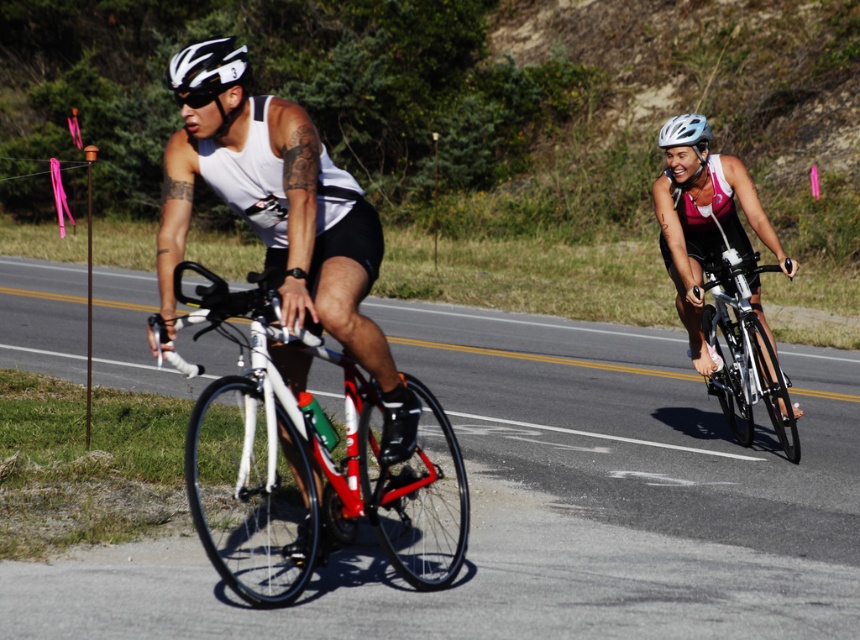
Between shiny white frame at center and white matte bicycle helmet at upper left, which one is positioned higher?

white matte bicycle helmet at upper left

Who is positioned more to the left, shiny white frame at center or white matte bicycle helmet at upper left?

Positioned to the left is white matte bicycle helmet at upper left.

Who is more distant from viewer, (413, 566) or (241, 74)?

The point (413, 566) is behind.

What are the coordinates of `shiny white frame at center` in the screenshot? It's located at (309, 465).

In the scene shown: Who is taller, matte white tank top at center or silver metallic bicycle at right?

Standing taller between the two is matte white tank top at center.

Can you confirm if matte white tank top at center is taller than silver metallic bicycle at right?

Correct, matte white tank top at center is much taller as silver metallic bicycle at right.

Where is `matte white tank top at center`? The image size is (860, 640). matte white tank top at center is located at coordinates (286, 228).

Is white matte bicycle helmet at upper left shorter than white matte helmet at upper right?

Yes, white matte bicycle helmet at upper left is shorter than white matte helmet at upper right.

Does white matte bicycle helmet at upper left appear on the right side of white matte helmet at upper right?

In fact, white matte bicycle helmet at upper left is to the left of white matte helmet at upper right.

Between point (209, 45) and point (703, 124), which one is positioned behind?

The point (703, 124) is behind.

In order to click on white matte bicycle helmet at upper left in this screenshot , I will do `click(207, 67)`.